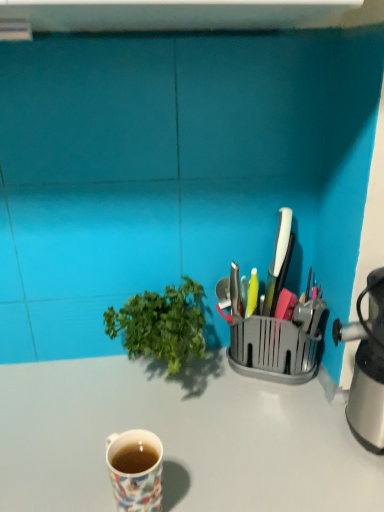
What do you see at coordinates (180, 437) in the screenshot? This screenshot has width=384, height=512. I see `white glossy desk at center` at bounding box center [180, 437].

In order to click on floral ceramic mug at lower left in this screenshot , I will do `click(135, 470)`.

At what (x,y) coordinates should I click in order to perform the action: click on green leafy plant at center. Please return your answer as a coordinate pair (x, y). This screenshot has height=512, width=384. Looking at the image, I should click on (162, 324).

At what (x,y) coordinates should I click in order to perform the action: click on white glossy desk at center. Please return your answer as a coordinate pair (x, y). The width and height of the screenshot is (384, 512). Looking at the image, I should click on (180, 437).

Does white glossy desk at center touch metallic silver knife block at right?

No, white glossy desk at center is not beside metallic silver knife block at right.

Is white glossy desk at center wider than metallic silver knife block at right?

Indeed, white glossy desk at center has a greater width compared to metallic silver knife block at right.

Can you tell me how much white glossy desk at center and metallic silver knife block at right differ in facing direction?

0.411 degrees.

From the image's perspective, between white glossy desk at center and metallic silver knife block at right, who is located below?

white glossy desk at center appears lower in the image.

Is green leafy plant at center to the left of floral ceramic mug at lower left from the viewer's perspective?

No.

From the picture: From a real-world perspective, is green leafy plant at center located beneath floral ceramic mug at lower left?

No, from a real-world perspective, green leafy plant at center is not under floral ceramic mug at lower left.

Are green leafy plant at center and floral ceramic mug at lower left beside each other?

No, green leafy plant at center is not making contact with floral ceramic mug at lower left.

Does metallic silver knife block at right come in front of green leafy plant at center?

No.

Which object is wider, metallic silver knife block at right or green leafy plant at center?

green leafy plant at center.

Does metallic silver knife block at right have a smaller size compared to green leafy plant at center?

Yes.

Which is behind, point (284, 333) or point (103, 314)?

Point (103, 314)

Is the position of metallic silver knife block at right more distant than that of floral ceramic mug at lower left?

Yes, it is behind floral ceramic mug at lower left.

Consider the image. Which of these two, metallic silver knife block at right or floral ceramic mug at lower left, is wider?

metallic silver knife block at right is wider.

Considering the positions of objects metallic silver knife block at right and floral ceramic mug at lower left in the image provided, who is more to the right, metallic silver knife block at right or floral ceramic mug at lower left?

From the viewer's perspective, metallic silver knife block at right appears more on the right side.

I want to click on appliance behind the floral ceramic mug at lower left, so click(x=273, y=320).

Is point (132, 487) positioned behind point (143, 315)?

No, it is not.

Between floral ceramic mug at lower left and green leafy plant at center, which one has less height?

floral ceramic mug at lower left is shorter.

Is floral ceramic mug at lower left positioned with its back to green leafy plant at center?

Yes, floral ceramic mug at lower left is positioned with its back facing green leafy plant at center.

Looking at this image, considering the sizes of objects floral ceramic mug at lower left and green leafy plant at center in the image provided, who is thinner, floral ceramic mug at lower left or green leafy plant at center?

Thinner between the two is floral ceramic mug at lower left.

From a real-world perspective, does floral ceramic mug at lower left sit lower than white glossy desk at center?

Actually, floral ceramic mug at lower left is physically above white glossy desk at center in the real world.

Considering the sizes of floral ceramic mug at lower left and white glossy desk at center in the image, is floral ceramic mug at lower left wider or thinner than white glossy desk at center?

In the image, floral ceramic mug at lower left appears to be more narrow than white glossy desk at center.

Is floral ceramic mug at lower left placed right next to white glossy desk at center?

No, floral ceramic mug at lower left is not making contact with white glossy desk at center.

Locate an element on the screen. The width and height of the screenshot is (384, 512). desk located behind the floral ceramic mug at lower left is located at coordinates (180, 437).

Does point (242, 502) come farther from viewer compared to point (201, 356)?

No.

Which object is positioned more to the right, white glossy desk at center or green leafy plant at center?

white glossy desk at center is more to the right.

Which of these two, white glossy desk at center or green leafy plant at center, stands taller?

white glossy desk at center.

Is white glossy desk at center located outside green leafy plant at center?

Indeed, white glossy desk at center is completely outside green leafy plant at center.

Image resolution: width=384 pixels, height=512 pixels. Identify the location of appliance lying on the right of white glossy desk at center. (273, 320).

You are a GUI agent. You are given a task and a screenshot of the screen. Output one action in this format:
    pyautogui.click(x=<x>, y=<y>)
    Task: Click on the houseplant behind the floral ceramic mug at lower left
    
    Given the screenshot: What is the action you would take?
    pyautogui.click(x=162, y=324)

In the scene shown: Looking at the image, which one is located further to green leafy plant at center, floral ceramic mug at lower left or metallic silver knife block at right?

floral ceramic mug at lower left lies further to green leafy plant at center than the other object.

Looking at the image, which one is located closer to green leafy plant at center, white glossy desk at center or metallic silver knife block at right?

The object closer to green leafy plant at center is metallic silver knife block at right.

Based on their spatial positions, is green leafy plant at center or metallic silver knife block at right further from white glossy desk at center?

The object further to white glossy desk at center is metallic silver knife block at right.

When comparing their distances from metallic silver knife block at right, does green leafy plant at center or white glossy desk at center seem further?

white glossy desk at center is positioned further to the anchor metallic silver knife block at right.

Based on their spatial positions, is green leafy plant at center or floral ceramic mug at lower left further from metallic silver knife block at right?

Based on the image, floral ceramic mug at lower left appears to be further to metallic silver knife block at right.

From the image, which object appears to be farther from white glossy desk at center, floral ceramic mug at lower left or green leafy plant at center?

floral ceramic mug at lower left is further to white glossy desk at center.

Looking at the image, which one is located further to green leafy plant at center, floral ceramic mug at lower left or white glossy desk at center?

floral ceramic mug at lower left.

Considering their positions, is white glossy desk at center positioned closer to metallic silver knife block at right than floral ceramic mug at lower left?

white glossy desk at center is positioned closer to the anchor metallic silver knife block at right.

You are a GUI agent. You are given a task and a screenshot of the screen. Output one action in this format:
    pyautogui.click(x=<x>, y=<y>)
    Task: Click on the coffee cup between metallic silver knife block at right and white glossy desk at center in the up-down direction
    This screenshot has width=384, height=512.
    Given the screenshot: What is the action you would take?
    pyautogui.click(x=135, y=470)

The width and height of the screenshot is (384, 512). In order to click on houseplant between metallic silver knife block at right and white glossy desk at center in the vertical direction in this screenshot , I will do `click(162, 324)`.

At what (x,y) coordinates should I click in order to perform the action: click on houseplant located between floral ceramic mug at lower left and metallic silver knife block at right in the left-right direction. Please return your answer as a coordinate pair (x, y). Looking at the image, I should click on (162, 324).

Locate an element on the screen. The height and width of the screenshot is (512, 384). coffee cup between green leafy plant at center and white glossy desk at center in the vertical direction is located at coordinates (135, 470).